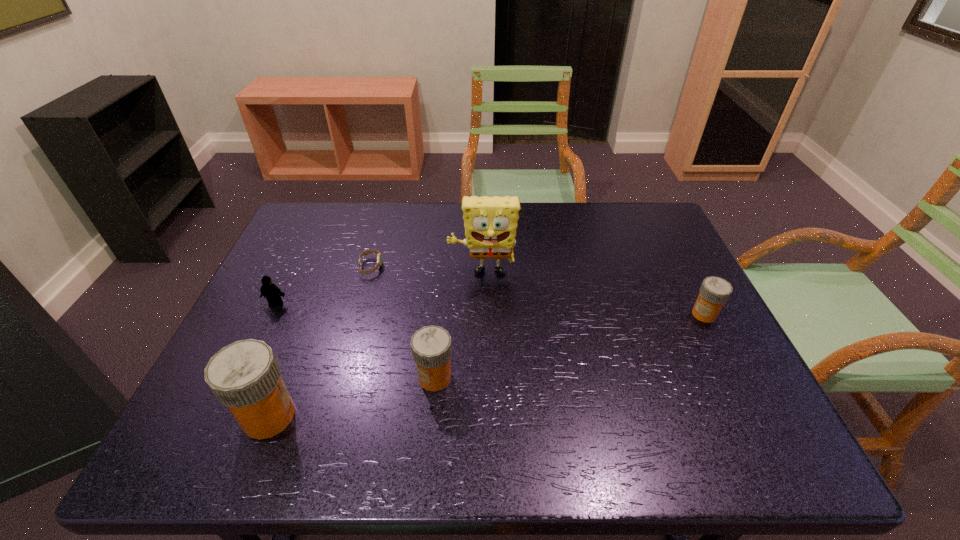
Find the location of a particular element. The height and width of the screenshot is (540, 960). location for an additional medicine to make spacing equal is located at coordinates (579, 343).